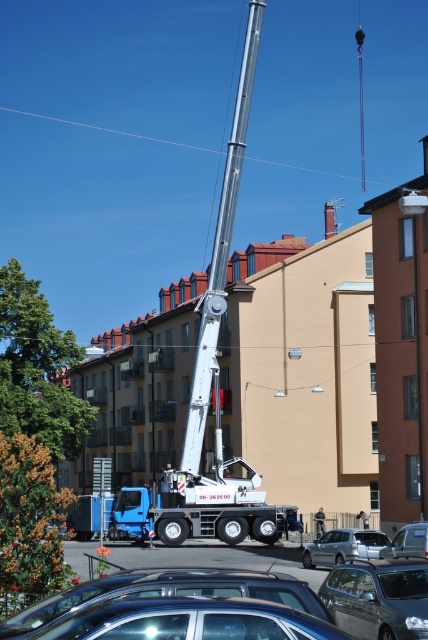
Question: Which point is closer to the camera?

Choices:
 (A) silver metallic car at center
 (B) metallic blue car at lower center
 (C) metallic gray sedan at center
 (D) metallic silver car at lower center

Answer: (B)

Question: Does metallic gray sedan at center appear on the left side of metallic silver sedan at center?

Choices:
 (A) yes
 (B) no

Answer: (A)

Question: Can you confirm if metallic gray sedan at center is positioned to the right of silver metallic car at center?

Choices:
 (A) no
 (B) yes

Answer: (A)

Question: Considering the relative positions of metallic blue car at lower center and silver metallic car at center in the image provided, where is metallic blue car at lower center located with respect to silver metallic car at center?

Choices:
 (A) above
 (B) below

Answer: (A)

Question: Which of the following is the farthest from the observer?

Choices:
 (A) (348, 556)
 (B) (253, 589)

Answer: (A)

Question: Which of these objects is positioned closest to the metallic blue car at lower center?

Choices:
 (A) metallic silver sedan at center
 (B) metallic gray sedan at center
 (C) metallic silver car at lower center

Answer: (C)